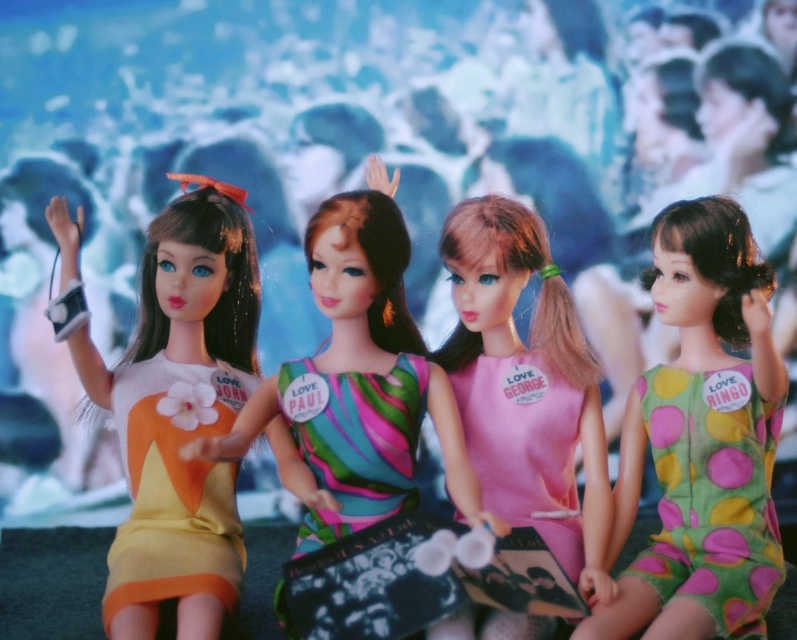
Who is positioned more to the right, pink fabric dress at center or matte plastic doll at center?

pink fabric dress at center

Who is more forward, (560, 426) or (464, 448)?

Point (464, 448)

Locate an element on the screen. The height and width of the screenshot is (640, 797). pink fabric dress at center is located at coordinates (525, 387).

From the picture: Does green polka dot dress at center have a greater width compared to matte plastic doll at left?

Yes, green polka dot dress at center is wider than matte plastic doll at left.

Does green polka dot dress at center have a greater height compared to matte plastic doll at left?

Incorrect, green polka dot dress at center's height is not larger of matte plastic doll at left's.

Where is `green polka dot dress at center`? green polka dot dress at center is located at coordinates (701, 440).

At what (x,y) coordinates should I click in order to perform the action: click on green polka dot dress at center. Please return your answer as a coordinate pair (x, y). Looking at the image, I should click on (701, 440).

This screenshot has width=797, height=640. Describe the element at coordinates (701, 440) in the screenshot. I see `green polka dot dress at center` at that location.

Identify the location of green polka dot dress at center. Image resolution: width=797 pixels, height=640 pixels. (701, 440).

This screenshot has height=640, width=797. Find the location of `green polka dot dress at center`. green polka dot dress at center is located at coordinates (701, 440).